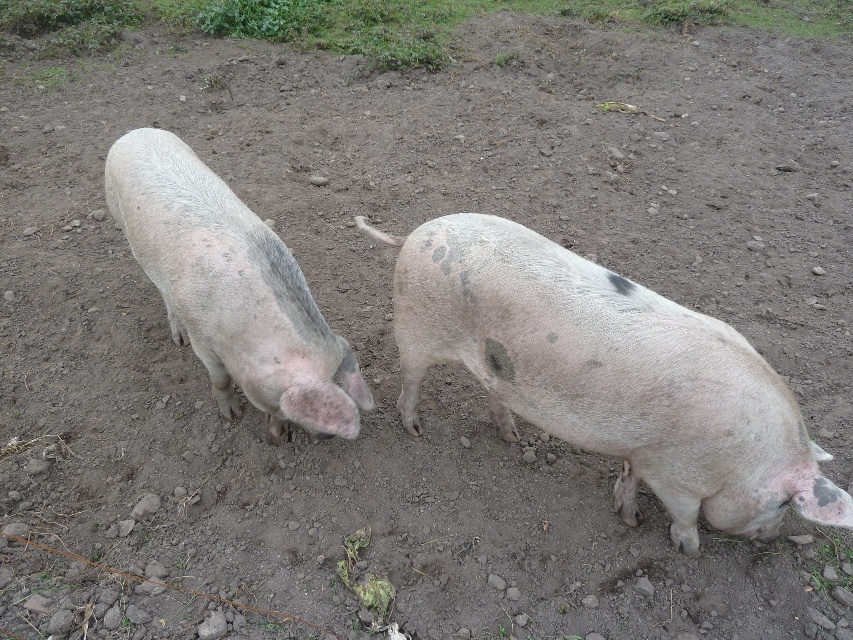
Question: Among these points, which one is farthest from the camera?

Choices:
 (A) (601, 355)
 (B) (262, 262)

Answer: (B)

Question: Where is speckled pink pig at right located in relation to gray matte pig at left in the image?

Choices:
 (A) right
 (B) left

Answer: (A)

Question: Which of the following is the farthest from the observer?

Choices:
 (A) (252, 394)
 (B) (637, 289)

Answer: (A)

Question: Is speckled pink pig at right thinner than gray matte pig at left?

Choices:
 (A) no
 (B) yes

Answer: (A)

Question: Does speckled pink pig at right come in front of gray matte pig at left?

Choices:
 (A) yes
 (B) no

Answer: (A)